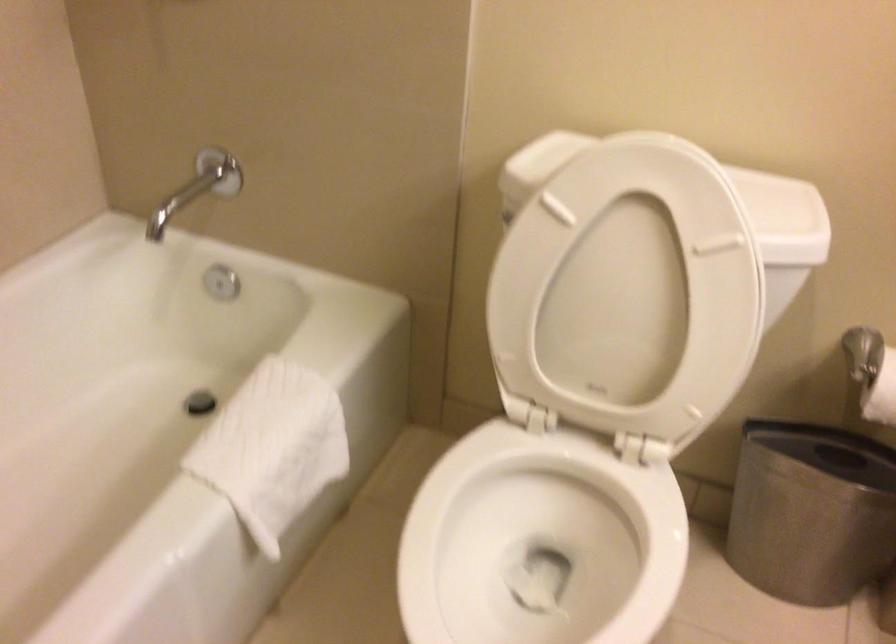
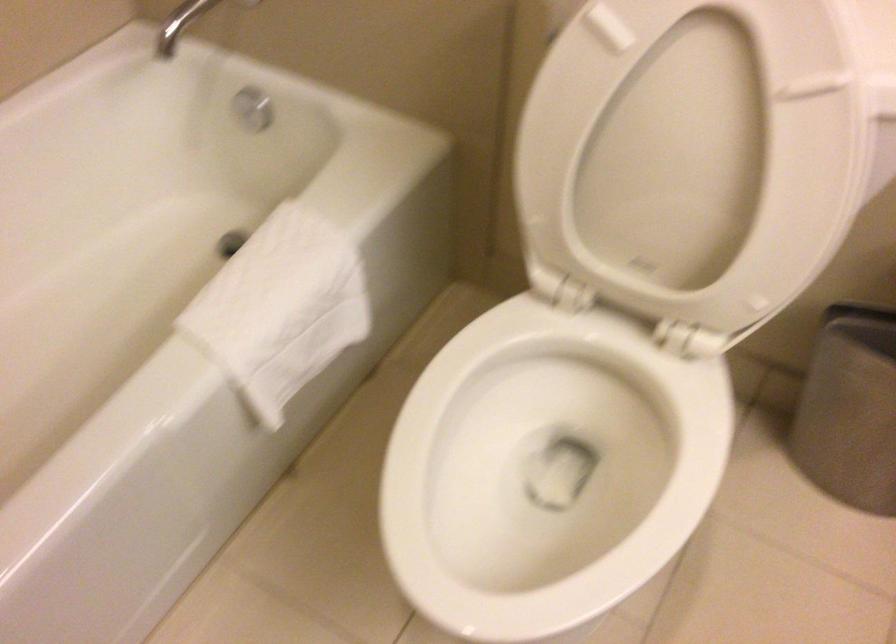
Where in the second image is the point corresponding to (x=780, y=504) from the first image?

(858, 402)